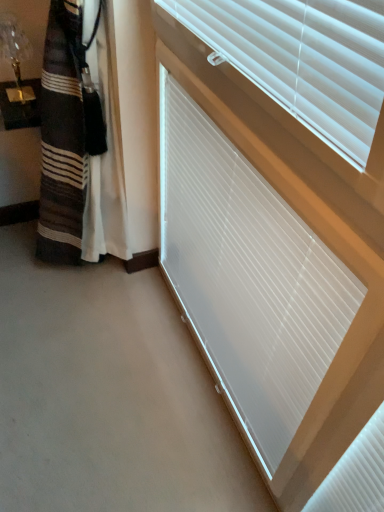
Locate an element on the screen. white plastic window blind at upper right is located at coordinates (248, 276).

What do you see at coordinates (248, 276) in the screenshot?
I see `white plastic window blind at upper right` at bounding box center [248, 276].

This screenshot has height=512, width=384. Find the location of `white plastic window blind at upper right`. white plastic window blind at upper right is located at coordinates (248, 276).